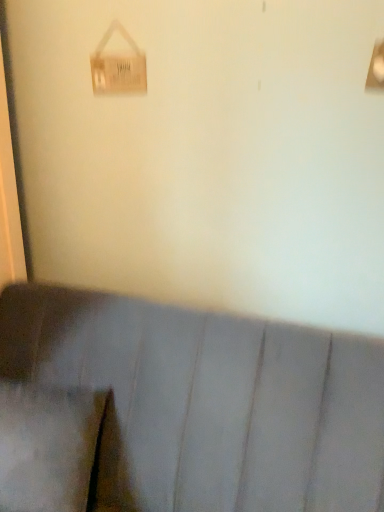
Question: Is suede-like gray pillow at lower left located within suede-like gray couch at lower center?

Choices:
 (A) no
 (B) yes

Answer: (B)

Question: Is suede-like gray couch at lower center wider than suede-like gray pillow at lower left?

Choices:
 (A) no
 (B) yes

Answer: (B)

Question: Does suede-like gray couch at lower center turn towards suede-like gray pillow at lower left?

Choices:
 (A) no
 (B) yes

Answer: (B)

Question: Does suede-like gray couch at lower center have a lesser width compared to suede-like gray pillow at lower left?

Choices:
 (A) yes
 (B) no

Answer: (B)

Question: Can you confirm if suede-like gray couch at lower center is positioned to the right of suede-like gray pillow at lower left?

Choices:
 (A) yes
 (B) no

Answer: (A)

Question: Considering the positions of suede-like gray couch at lower center and wooden sign at upper left in the image, is suede-like gray couch at lower center taller or shorter than wooden sign at upper left?

Choices:
 (A) tall
 (B) short

Answer: (A)

Question: Is suede-like gray couch at lower center to the left or to the right of wooden sign at upper left in the image?

Choices:
 (A) left
 (B) right

Answer: (B)

Question: Is point (370, 479) closer or farther from the camera than point (124, 31)?

Choices:
 (A) closer
 (B) farther

Answer: (A)

Question: Is suede-like gray couch at lower center in front of or behind wooden sign at upper left in the image?

Choices:
 (A) behind
 (B) front

Answer: (B)

Question: Considering the positions of suede-like gray pillow at lower left and wooden sign at upper left in the image, is suede-like gray pillow at lower left wider or thinner than wooden sign at upper left?

Choices:
 (A) wide
 (B) thin

Answer: (A)

Question: From the image's perspective, is suede-like gray pillow at lower left located above or below wooden sign at upper left?

Choices:
 (A) below
 (B) above

Answer: (A)

Question: Is suede-like gray pillow at lower left in front of or behind wooden sign at upper left in the image?

Choices:
 (A) behind
 (B) front

Answer: (B)

Question: Is suede-like gray pillow at lower left inside or outside of wooden sign at upper left?

Choices:
 (A) inside
 (B) outside

Answer: (B)

Question: In the image, is wooden sign at upper left positioned in front of or behind suede-like gray pillow at lower left?

Choices:
 (A) behind
 (B) front

Answer: (A)

Question: From the image's perspective, is wooden sign at upper left positioned above or below suede-like gray pillow at lower left?

Choices:
 (A) below
 (B) above

Answer: (B)